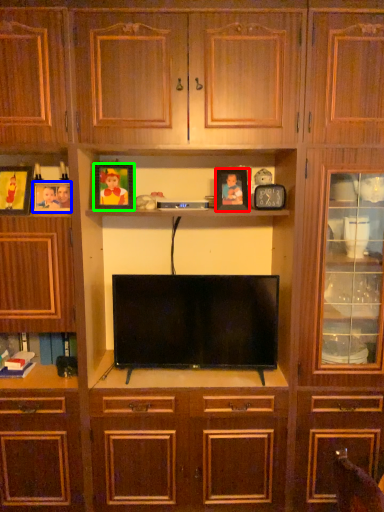
Question: Which object is positioned closest to picture frame (highlighted by a red box)? Select from picture frame (highlighted by a blue box) and picture frame (highlighted by a green box).

Choices:
 (A) picture frame
 (B) picture frame

Answer: (B)